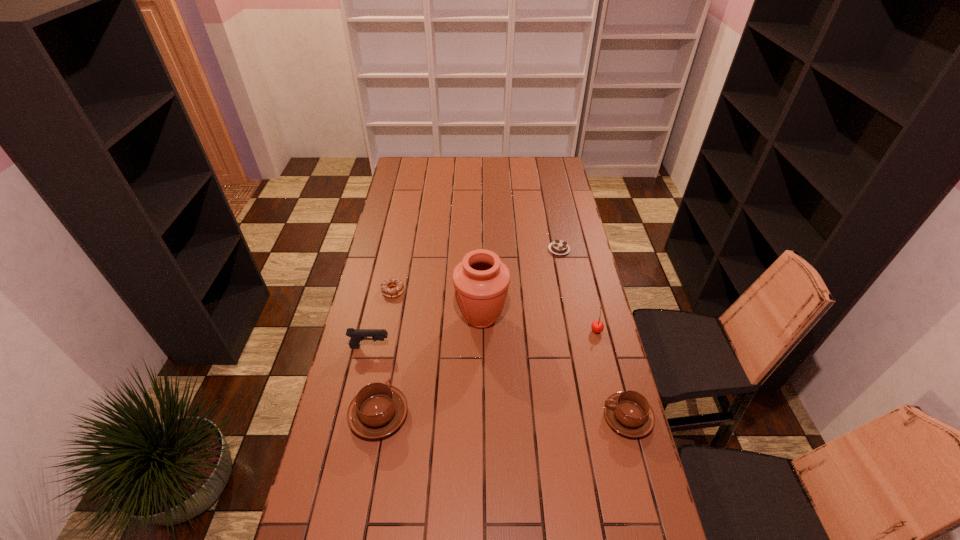
The image size is (960, 540). Find the location of `the taller cappuccino`. the taller cappuccino is located at coordinates (378, 409).

What are the coordinates of `the third shortest object` in the screenshot? It's located at (629, 413).

You are a GUI agent. You are given a task and a screenshot of the screen. Output one action in this format:
    pyautogui.click(x=<x>, y=<y>)
    Task: Click on the right cappuccino
    The image size is (960, 540).
    Given the screenshot: What is the action you would take?
    pyautogui.click(x=629, y=413)

In order to click on the farthest object in this screenshot , I will do [558, 247].

Where is `chocolate cake`? The height and width of the screenshot is (540, 960). chocolate cake is located at coordinates (558, 247).

Identify the location of cherry. The image size is (960, 540). (597, 326).

Identify the location of the fourth object from right to left. This screenshot has height=540, width=960. (481, 281).

Locate an element on the screen. This screenshot has width=960, height=540. the tallest object is located at coordinates (481, 281).

I want to click on the fifth farthest object, so click(x=356, y=335).

The width and height of the screenshot is (960, 540). I want to click on doughnut, so click(x=396, y=282).